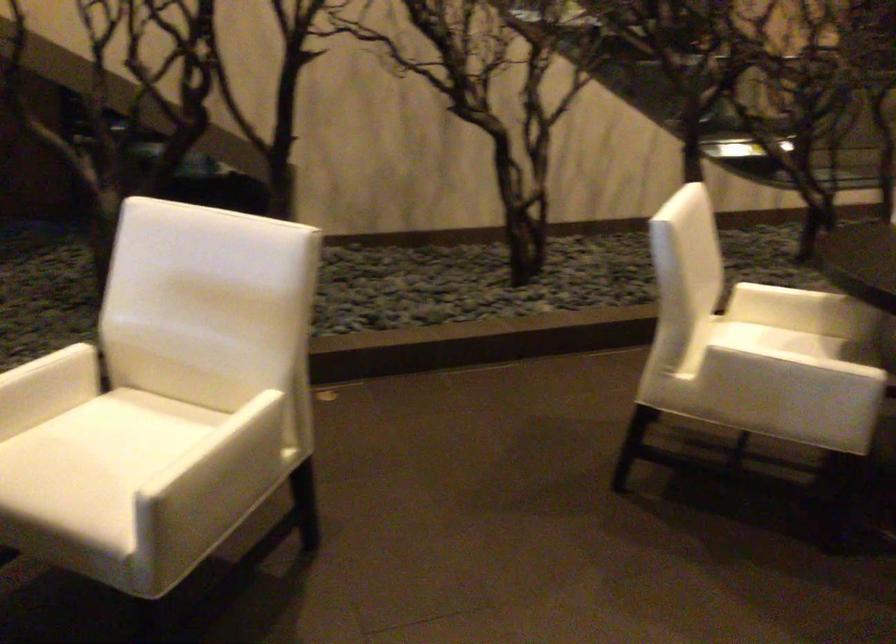
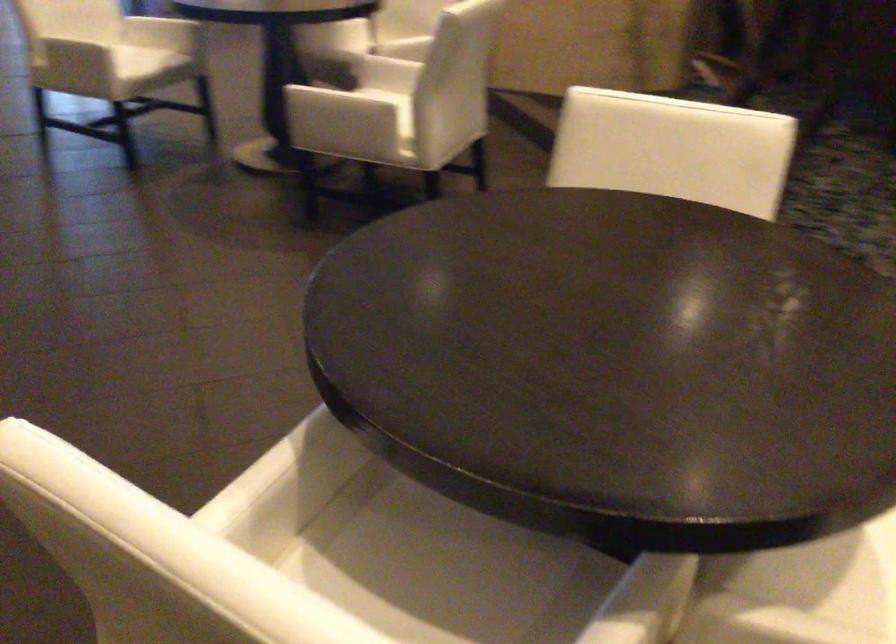
Locate, in the second image, the point that corresponds to point 692,232 in the first image.

(673, 149)